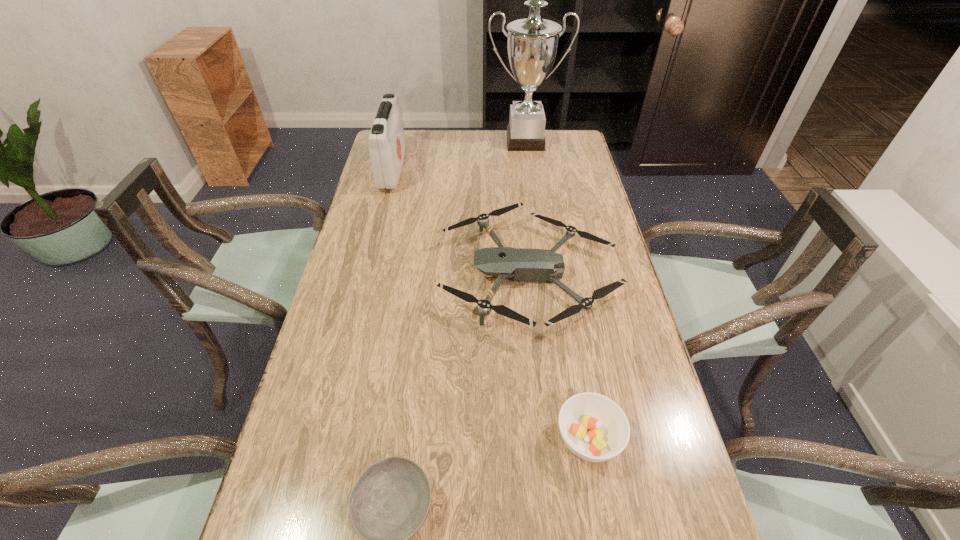
Locate an element on the screen. The height and width of the screenshot is (540, 960). unoccupied position between the first-aid kit and the drone is located at coordinates (461, 222).

I want to click on the fourth closest object relative to the trophy cup, so click(390, 501).

Locate an element on the screen. object that is the closest to the trophy cup is located at coordinates (387, 147).

At what (x,y) coordinates should I click in order to perform the action: click on vacant region that satisfies the following two spatial constraints: 1. at the front view of the soup bowl; 2. on the left side of the trophy cup. Please return your answer as a coordinate pair (x, y). The image size is (960, 540). Looking at the image, I should click on (566, 439).

Locate an element on the screen. vacant space that satisfies the following two spatial constraints: 1. at the front view of the trophy cup; 2. with a camera mounted on the front of the drone is located at coordinates (543, 274).

At what (x,y) coordinates should I click in order to perform the action: click on vacant area that satisfies the following two spatial constraints: 1. on the back side of the soup bowl; 2. on the front side of the fourth shortest object. Please return your answer as a coordinate pair (x, y). Looking at the image, I should click on (541, 170).

Where is `vacant space that satisfies the following two spatial constraints: 1. at the front view of the tallest object; 2. on the front side of the second tallest object`? The height and width of the screenshot is (540, 960). vacant space that satisfies the following two spatial constraints: 1. at the front view of the tallest object; 2. on the front side of the second tallest object is located at coordinates (529, 170).